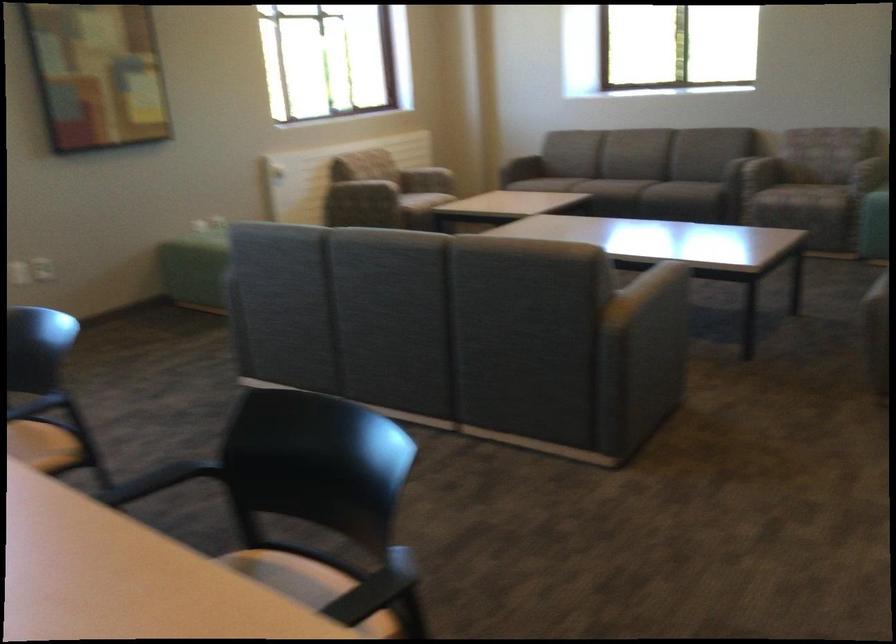
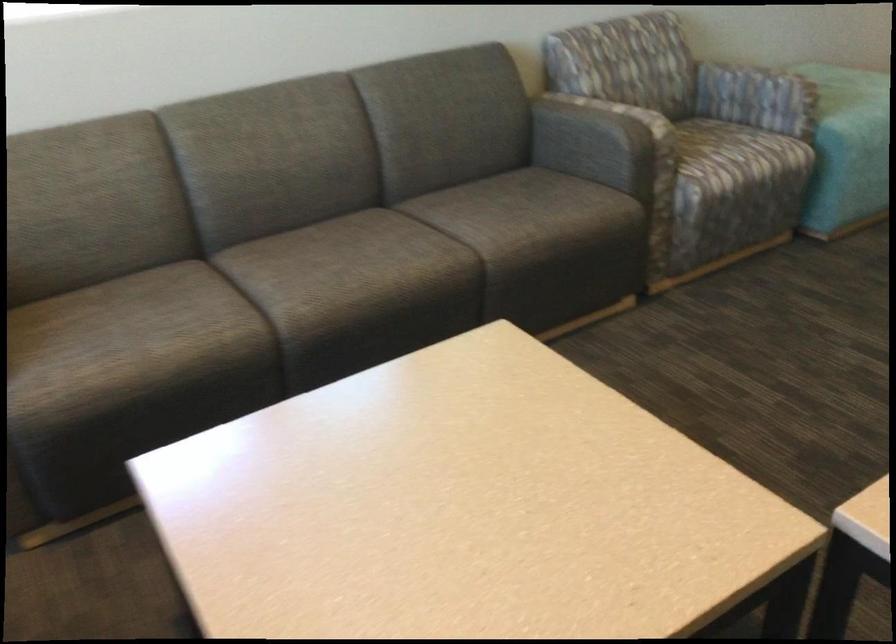
In the second image, find the point that corresponds to the point at 711,160 in the first image.

(597, 140)